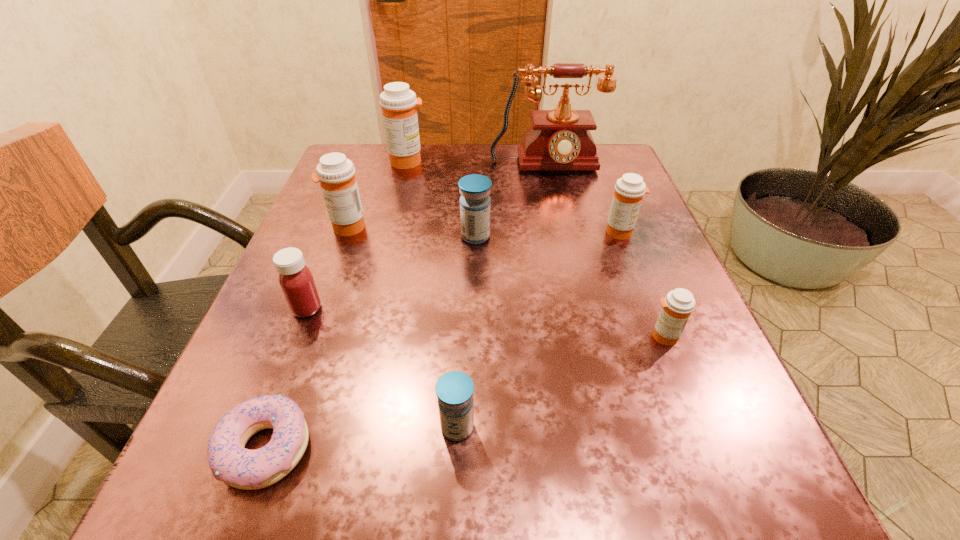
Identify the location of free area in between the second tallest medicine and the doughnut. This screenshot has height=540, width=960. (306, 337).

Locate an element on the screen. Image resolution: width=960 pixels, height=540 pixels. vacant area that lies between the third biggest orange medicine and the doughnut is located at coordinates (443, 340).

Find the location of a particular element. free spot between the farther blue medicine and the nearer blue medicine is located at coordinates (467, 332).

At what (x,y) coordinates should I click in order to perform the action: click on blank region between the pink doughnut and the bigger blue medicine. Please return your answer as a coordinate pair (x, y). The image size is (960, 540). Looking at the image, I should click on (371, 342).

Locate an element on the screen. This screenshot has width=960, height=540. empty space between the tallest object and the third biggest orange medicine is located at coordinates (584, 199).

The width and height of the screenshot is (960, 540). I want to click on free space that is in between the leftmost orange medicine and the fourth nearest object, so click(327, 268).

At what (x,y) coordinates should I click in order to perform the action: click on empty space between the farthest medicine and the nearest medicine. Please return your answer as a coordinate pair (x, y). Looking at the image, I should click on coord(433,294).

At what (x,y) coordinates should I click in order to perform the action: click on vacant area that lies between the farther blue medicine and the telephone. Please return your answer as a coordinate pair (x, y). This screenshot has width=960, height=540. Looking at the image, I should click on (511, 202).

Locate an element on the screen. The height and width of the screenshot is (540, 960). the fifth closest object to the smaller blue medicine is located at coordinates (336, 174).

Locate an element on the screen. the sixth closest object to the doughnut is located at coordinates (629, 190).